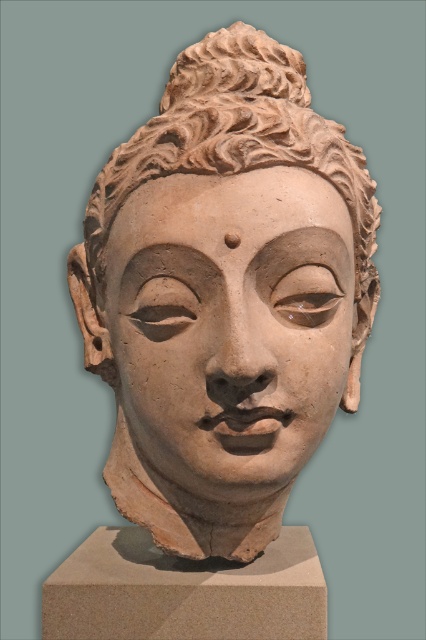
You are an art conservator examining the sculpture. You notice two parts labeled as the matte clay head at center and the matte clay face at center. Which part has a larger size?

The matte clay head at center is bigger than the matte clay face at center, so the matte clay head at center has a larger size.

You are an art conservator examining the sculpture. You notice a small point marked at coordinates (x=226, y=294). According to the description, what material is present at this point?

The point at coordinates (x=226, y=294) corresponds to the matte clay head at center, so the material present there is matte clay.